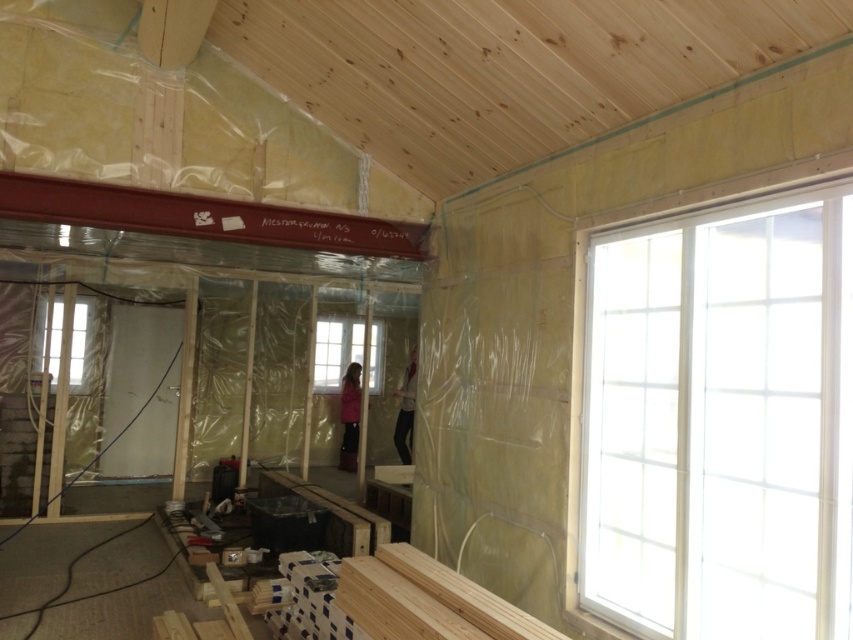
You are an inspector checking the insulation installation in the room. You notice two clear glass windows, the clear glass window at upper right and the clear glass window at left. Which window is positioned lower in the room?

The clear glass window at upper right is located below the clear glass window at left, so it is positioned lower in the room.

You are standing in the center of the room. Where is the clear glass window at upper right located relative to your position?

The clear glass window at upper right is located at the upper right relative to your position in the center of the room.